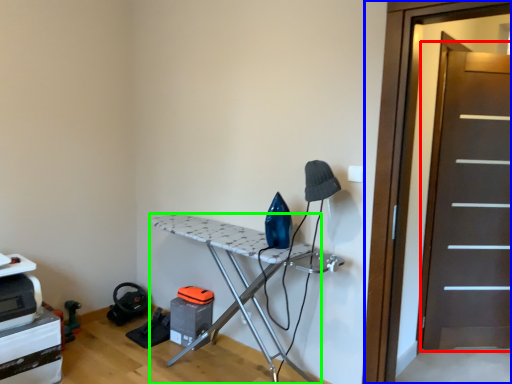
Question: Estimate the real-world distances between objects in this image. Which object is closer to screen door (highlighted by a red box), screen door (highlighted by a blue box) or furniture (highlighted by a green box)?

Choices:
 (A) screen door
 (B) furniture

Answer: (A)